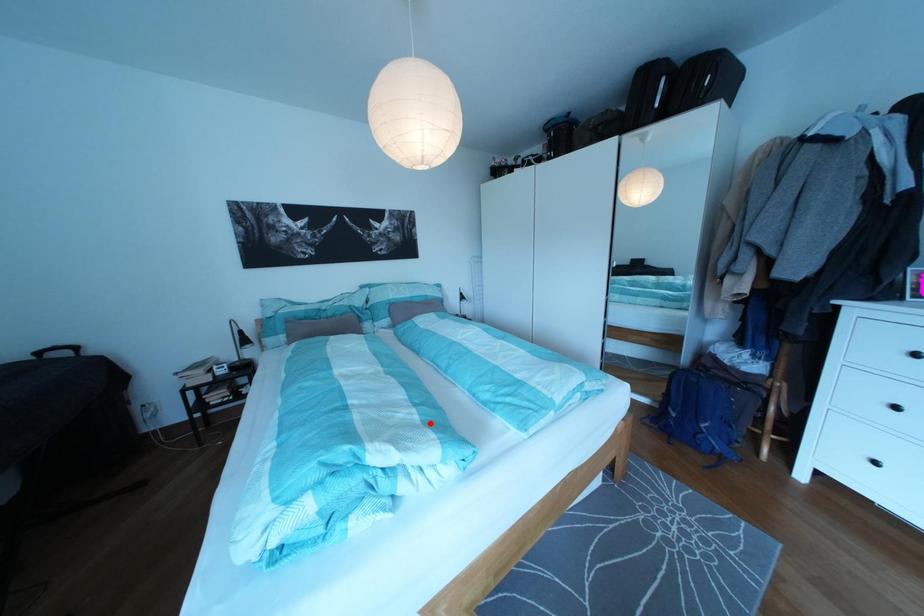
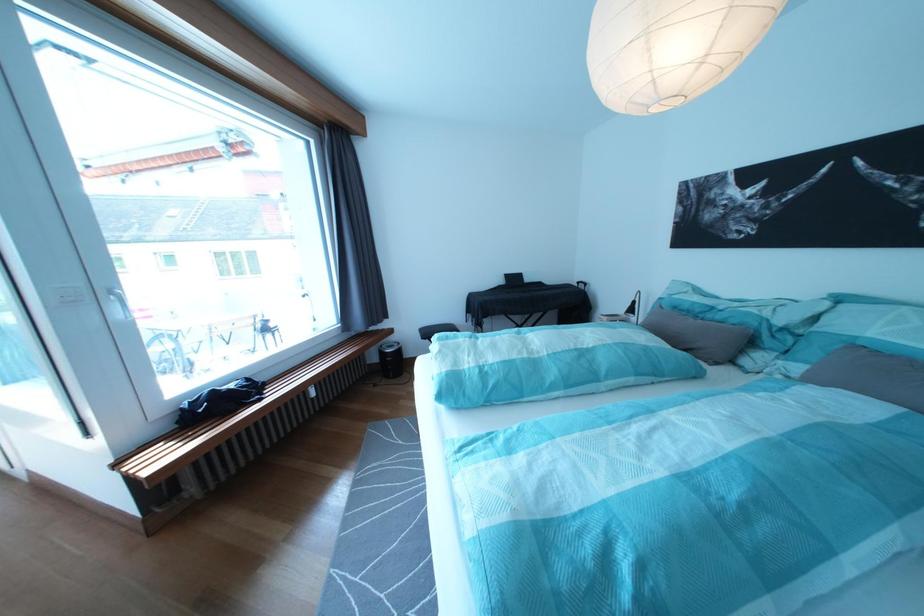
In the second image, find the point that corresponds to the highlighted location in the first image.

(480, 373)